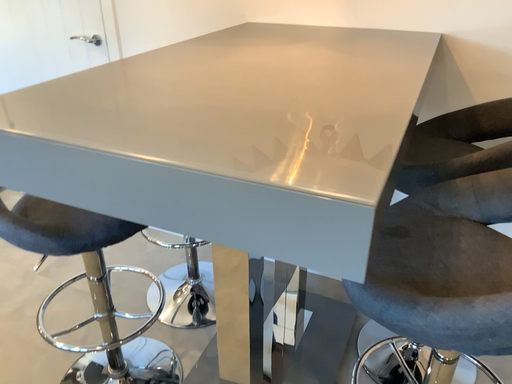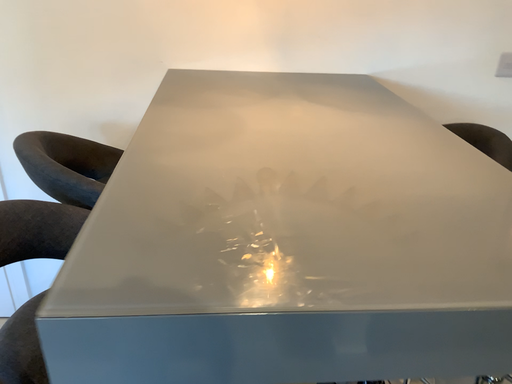
Question: How did the camera likely rotate when shooting the video?

Choices:
 (A) rotated right
 (B) rotated left

Answer: (A)